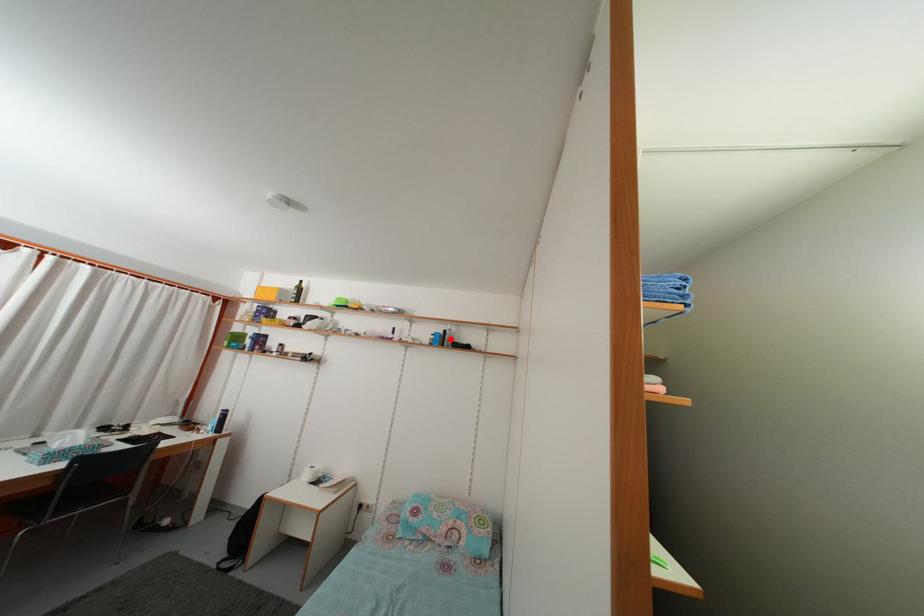
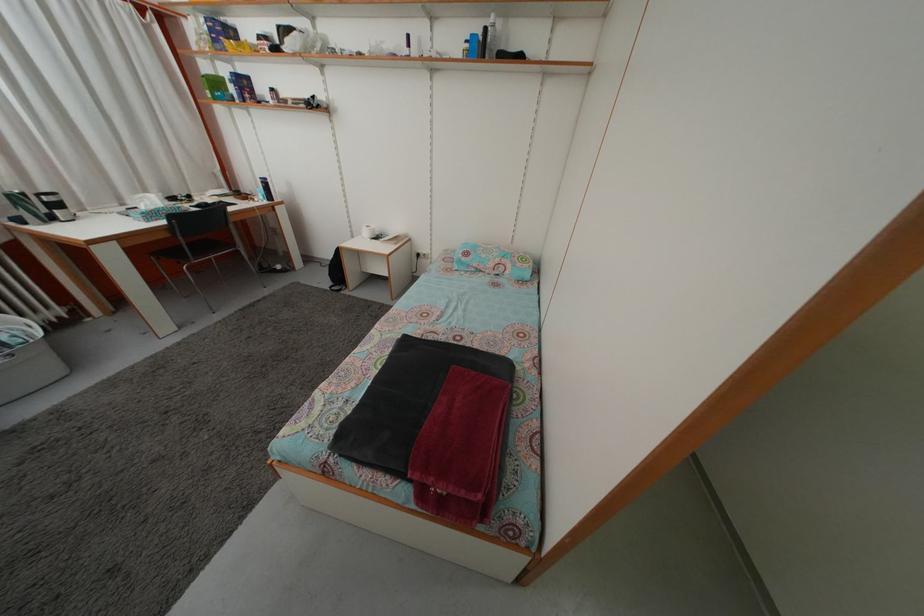
Find the pixel in the second image that matches the highlighted location in the first image.

(492, 38)